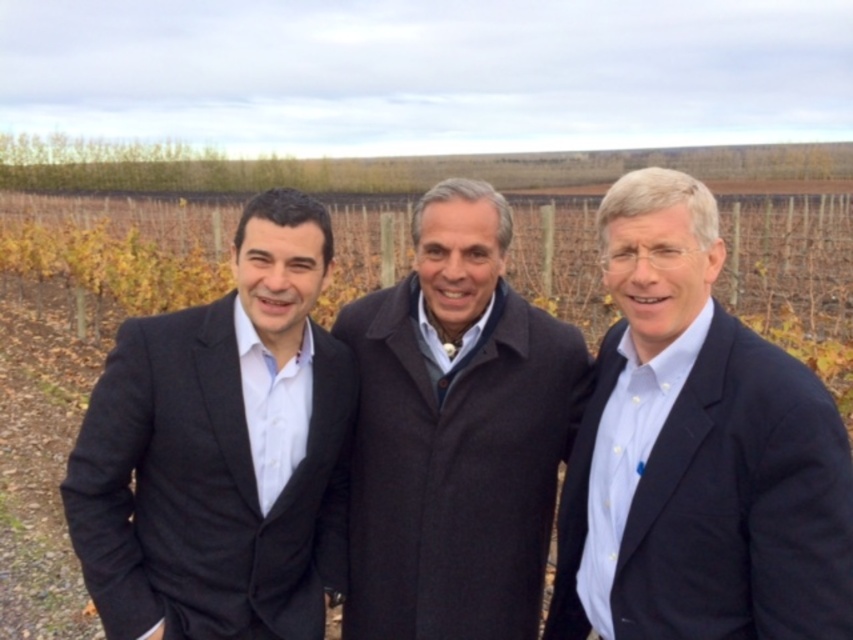
You are a photographer setting up for a group photo in the vineyard. You need to ensure that the light blue shirt at center and the matte black suit at left are both visible in the frame. Considering their heights, which one might need to be positioned closer to the camera to avoid being obscured?

The matte black suit at left is shorter than the light blue shirt at center, so positioning it closer to the camera would help ensure it remains visible and not obscured by the taller object.

You are a photographer positioned at the origin point of the image. You need to capture a photo of the light blue shirt at center. What are the coordinates where you should aim your camera?

The coordinates where you should aim your camera are at point (695, 452).

You are standing at the point labeled as point (695, 452). What is the color of the clothing item you are currently standing on?

The point (695, 452) is on the light blue shirt at center, so the clothing item you are standing on is light blue in color.